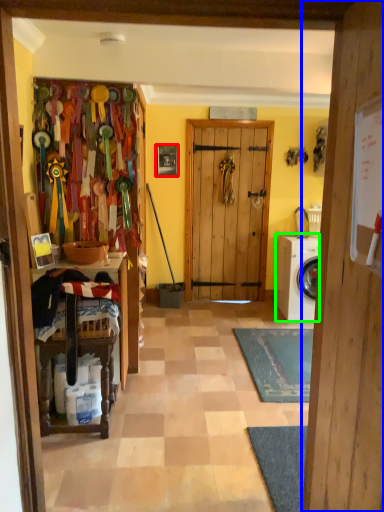
Question: Based on their relative distances, which object is farther from picture frame (highlighted by a red box)? Choose from door (highlighted by a blue box) and washing machine (highlighted by a green box).

Choices:
 (A) door
 (B) washing machine

Answer: (A)